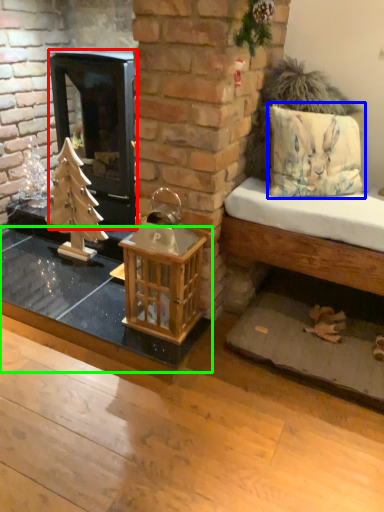
Question: Which is farther away from wood burning stove (highlighted by a red box)? pillow (highlighted by a blue box) or table (highlighted by a green box)?

Choices:
 (A) pillow
 (B) table

Answer: (A)